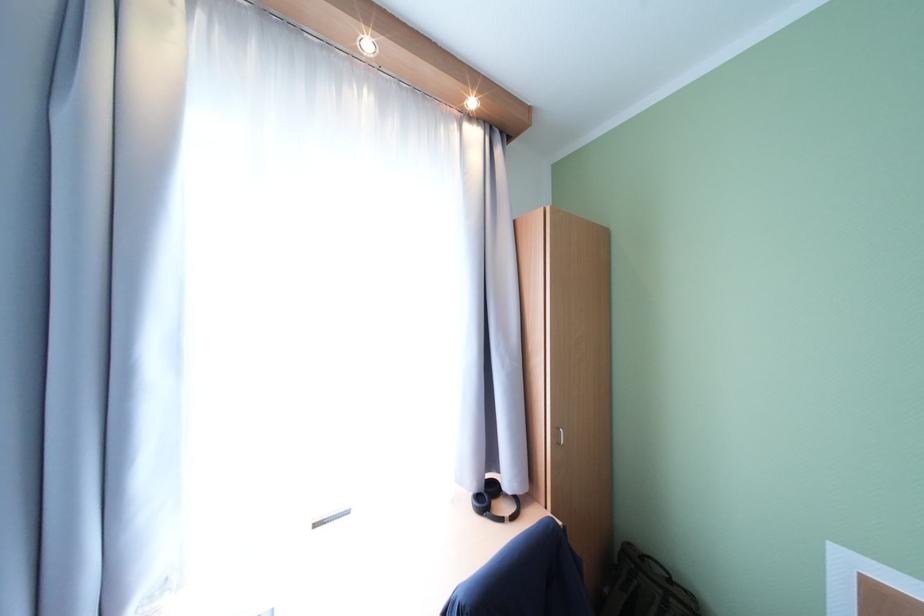
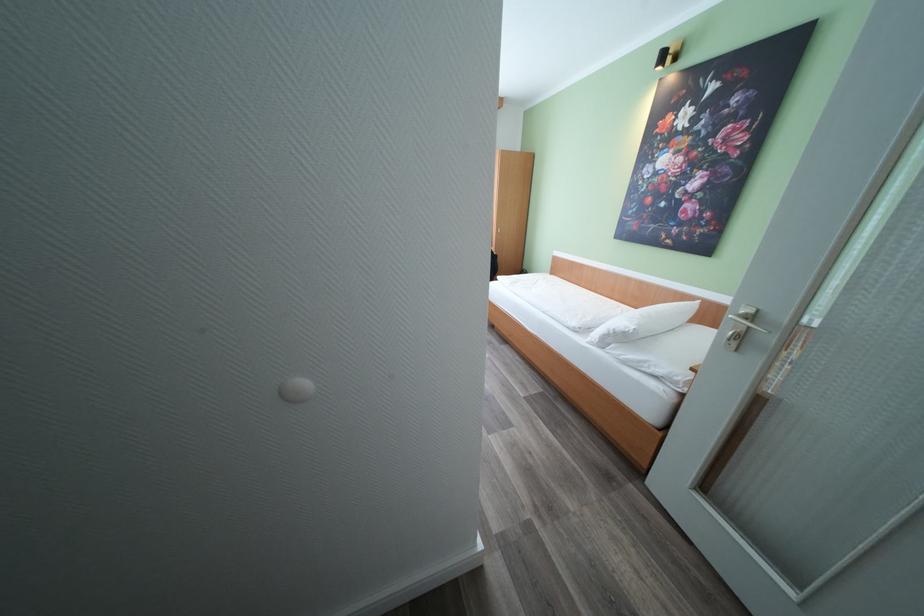
Question: In a continuous first-person perspective shot, in which direction is the camera moving?

Choices:
 (A) Left
 (B) Right
 (C) Forward
 (D) Backward

Answer: (D)